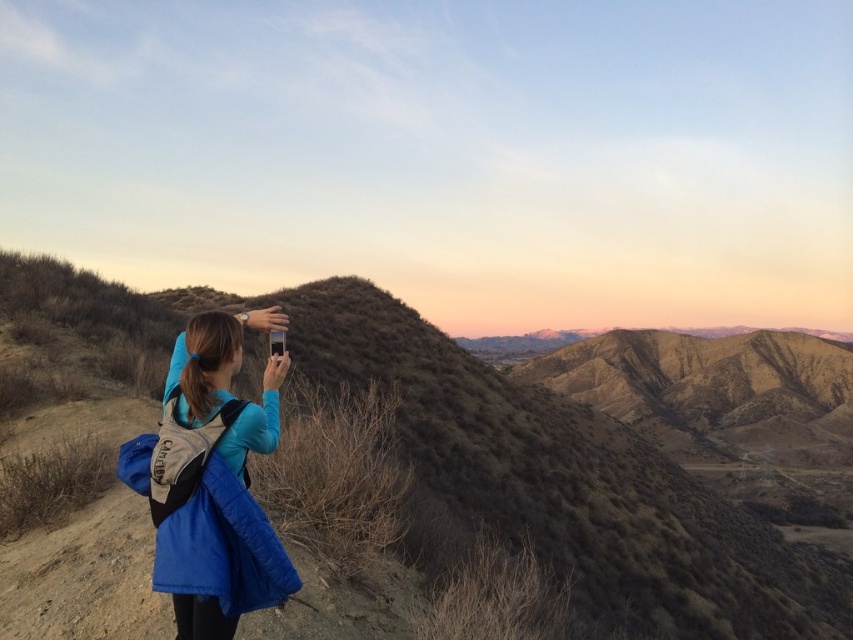
Between brown textured hillside at center and blue synthetic jacket at center, which one appears on the left side from the viewer's perspective?

blue synthetic jacket at center

Who is more forward, (723, 504) or (206, 531)?

Positioned in front is point (206, 531).

Identify the location of brown textured hillside at center. (566, 476).